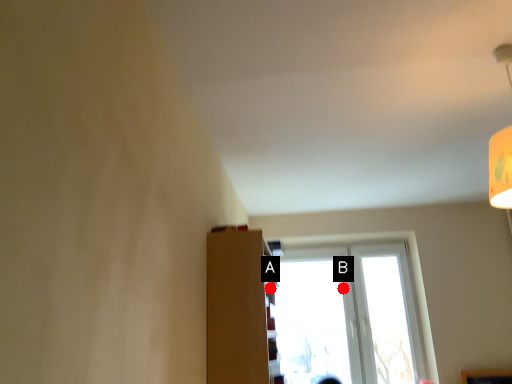
Question: Two points are circled on the image, labeled by A and B beside each circle. Which point appears closest to the camera in this image?

Choices:
 (A) A is closer
 (B) B is closer

Answer: (A)